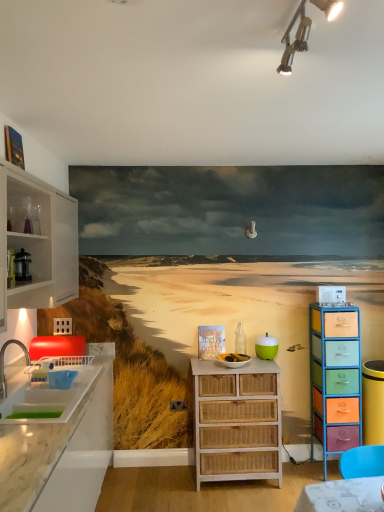
Identify the location of blank space to the left of white wicker chest of drawers at center, acting as the first chest of drawers starting from the left. (157, 488).